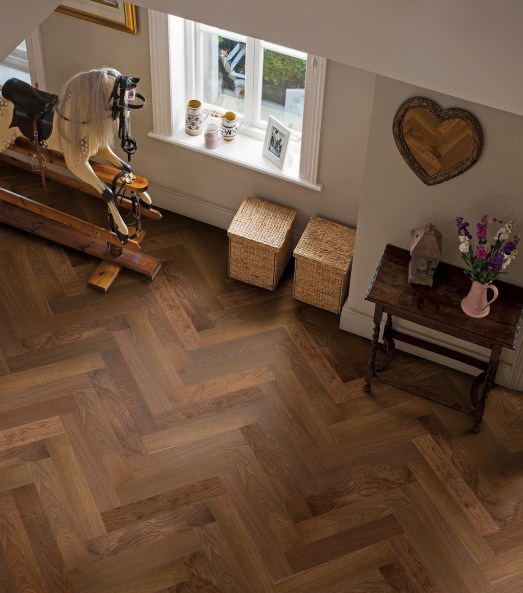
Where is `baby pink vase`? The image size is (523, 593). baby pink vase is located at coordinates (475, 298).